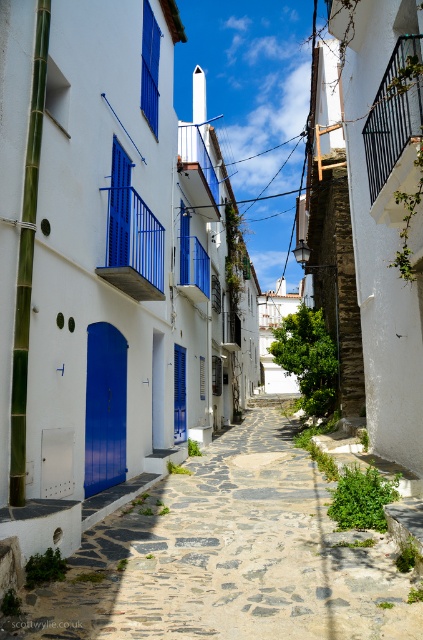
Which is behind, point (378, 90) or point (203, 273)?

The point (203, 273) is more distant.

Measure the distance from black metal balcony at upper right to blue painted metal balcony at center.

black metal balcony at upper right and blue painted metal balcony at center are 21.57 feet apart from each other.

Who is more forward, (406, 140) or (184, 252)?

Point (406, 140)

Identify the location of black metal balcony at upper right. (392, 116).

Who is taller, blue painted metal railing at center or black metal balcony at upper right?

blue painted metal railing at center is taller.

Find the location of a particular element. blue painted metal railing at center is located at coordinates (132, 244).

The image size is (423, 640). What do you see at coordinates (227, 557) in the screenshot? I see `stone paved path at center` at bounding box center [227, 557].

Can you confirm if stone paved path at center is positioned above black metal balcony at upper right?

No, stone paved path at center is not above black metal balcony at upper right.

Is point (206, 538) positioned before point (417, 118)?

No.

Identify the location of stone paved path at center. The height and width of the screenshot is (640, 423). (227, 557).